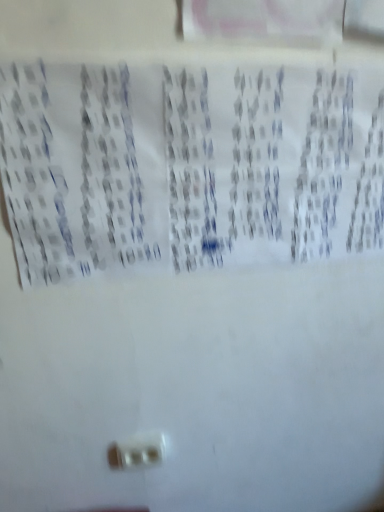
Question: Is white paper at center far away from white plastic power plugs and sockets at lower center?

Choices:
 (A) no
 (B) yes

Answer: (A)

Question: From a real-world perspective, does white paper at center stand above white plastic power plugs and sockets at lower center?

Choices:
 (A) yes
 (B) no

Answer: (A)

Question: Is white paper at center looking in the opposite direction of white plastic power plugs and sockets at lower center?

Choices:
 (A) yes
 (B) no

Answer: (B)

Question: Would you say white paper at center is outside white plastic power plugs and sockets at lower center?

Choices:
 (A) no
 (B) yes

Answer: (B)

Question: From a real-world perspective, is white paper at center under white plastic power plugs and sockets at lower center?

Choices:
 (A) no
 (B) yes

Answer: (A)

Question: Is the position of white paper at center more distant than that of white plastic power plugs and sockets at lower center?

Choices:
 (A) no
 (B) yes

Answer: (A)

Question: Can you confirm if white plastic power plugs and sockets at lower center is positioned to the left of white paper at center?

Choices:
 (A) yes
 (B) no

Answer: (A)

Question: From a real-world perspective, is white plastic power plugs and sockets at lower center physically above white paper at center?

Choices:
 (A) no
 (B) yes

Answer: (A)

Question: Considering the relative sizes of white plastic power plugs and sockets at lower center and white paper at center in the image provided, is white plastic power plugs and sockets at lower center shorter than white paper at center?

Choices:
 (A) yes
 (B) no

Answer: (A)

Question: Can you confirm if white plastic power plugs and sockets at lower center is positioned to the right of white paper at center?

Choices:
 (A) no
 (B) yes

Answer: (A)

Question: Is white plastic power plugs and sockets at lower center turned away from white paper at center?

Choices:
 (A) yes
 (B) no

Answer: (B)

Question: Is white plastic power plugs and sockets at lower center oriented towards white paper at center?

Choices:
 (A) yes
 (B) no

Answer: (B)

Question: From the image's perspective, is white plastic power plugs and sockets at lower center positioned above or below white paper at center?

Choices:
 (A) above
 (B) below

Answer: (B)